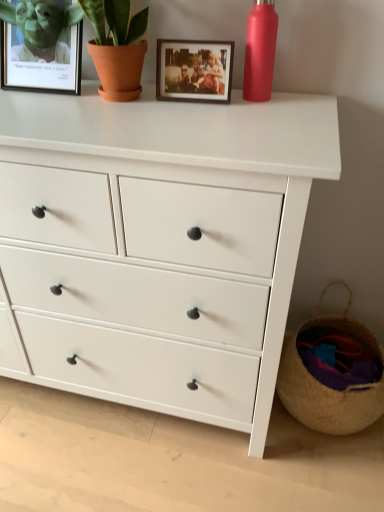
Question: From the image's perspective, is matte red bottle at upper right under white matte chest of drawers at center?

Choices:
 (A) no
 (B) yes

Answer: (A)

Question: Is matte red bottle at upper right smaller than white matte chest of drawers at center?

Choices:
 (A) no
 (B) yes

Answer: (B)

Question: Can white matte chest of drawers at center be found inside matte red bottle at upper right?

Choices:
 (A) no
 (B) yes

Answer: (A)

Question: From a real-world perspective, is matte red bottle at upper right on white matte chest of drawers at center?

Choices:
 (A) no
 (B) yes

Answer: (B)

Question: Is matte red bottle at upper right placed right next to white matte chest of drawers at center?

Choices:
 (A) yes
 (B) no

Answer: (B)

Question: Can you confirm if matte red bottle at upper right is shorter than white matte chest of drawers at center?

Choices:
 (A) yes
 (B) no

Answer: (A)

Question: Considering the relative sizes of woven straw basket at lower right and white matte chest of drawers at center in the image provided, is woven straw basket at lower right shorter than white matte chest of drawers at center?

Choices:
 (A) no
 (B) yes

Answer: (B)

Question: Can you confirm if woven straw basket at lower right is smaller than white matte chest of drawers at center?

Choices:
 (A) no
 (B) yes

Answer: (B)

Question: Can you confirm if woven straw basket at lower right is taller than white matte chest of drawers at center?

Choices:
 (A) no
 (B) yes

Answer: (A)

Question: Is woven straw basket at lower right positioned before white matte chest of drawers at center?

Choices:
 (A) yes
 (B) no

Answer: (B)

Question: From a real-world perspective, is woven straw basket at lower right located beneath white matte chest of drawers at center?

Choices:
 (A) no
 (B) yes

Answer: (B)

Question: From the image's perspective, is woven straw basket at lower right on white matte chest of drawers at center?

Choices:
 (A) no
 (B) yes

Answer: (A)

Question: From the image's perspective, is woven straw basket at lower right above wooden photo frame at upper center, which is counted as the 2th picture frame, starting from the left?

Choices:
 (A) yes
 (B) no

Answer: (B)